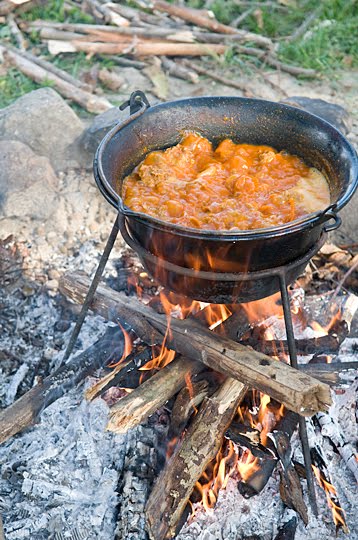
You are a GUI agent. You are given a task and a screenshot of the screen. Output one action in this format:
    pyautogui.click(x=<x>, y=<y>)
    Task: Click on the pot
    
    Given the screenshot: What is the action you would take?
    pyautogui.click(x=224, y=280)